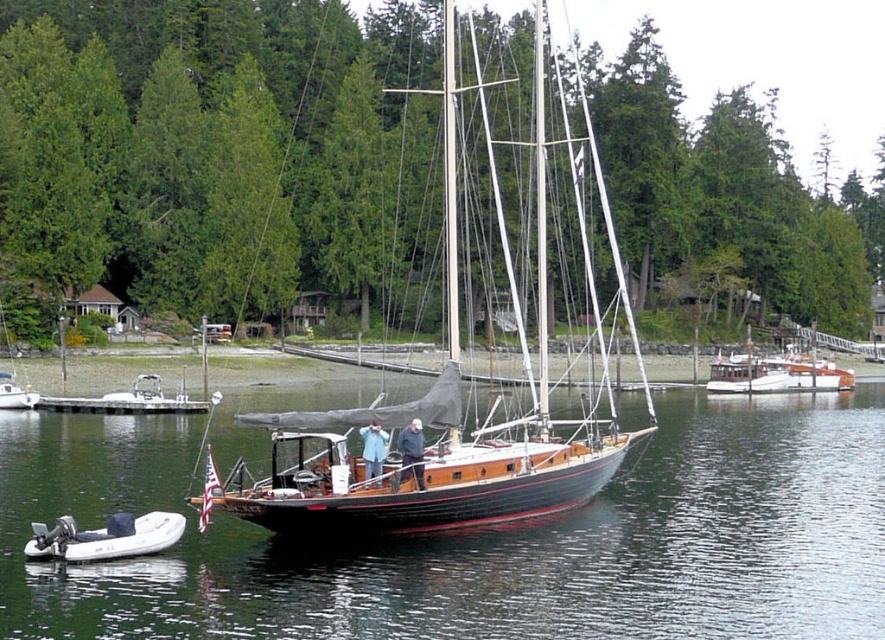
You are a boater planning to dock your boat near the wooden sailboat at center. You see the wooden boat at center nearby. Based on their positions, can you safely maneuver your boat between them without touching either?

The wooden boat at center is positioned under the wooden sailboat at center, meaning they are in the same location or overlapping. Maneuvering between them would not be possible as they occupy the same space.

You are a photographer planning to take a photo of the wooden boat at center and the green matte tree at center. From your current position, which object is closer to you?

The green matte tree at center is closer to you because the wooden boat at center is behind it.